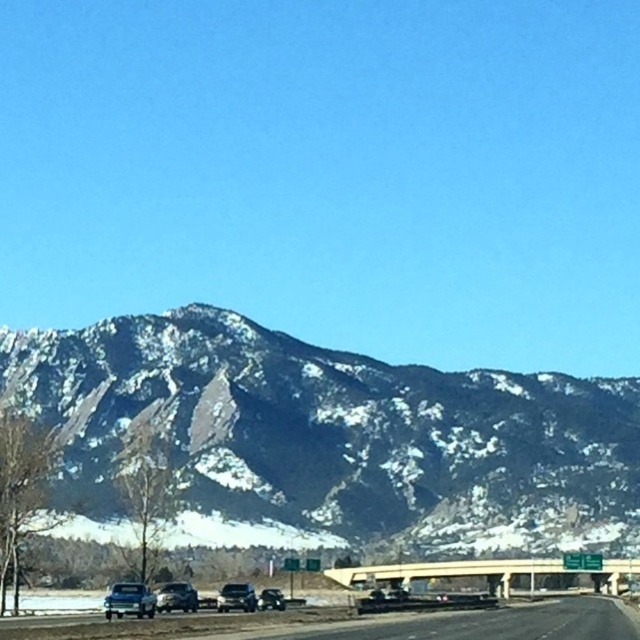
Question: Which object is positioned farthest from the shiny black suv at center?

Choices:
 (A) shiny black sedan at center
 (B) shiny silver sedan at center
 (C) shiny silver sedan at lower left

Answer: (C)

Question: Observing the image, what is the correct spatial positioning of snowy granite mountain range at upper center in reference to shiny black suv at center?

Choices:
 (A) left
 (B) right

Answer: (B)

Question: Which point is farther to the camera?

Choices:
 (A) (280, 605)
 (B) (225, 589)
 (C) (248, 410)
 (D) (195, 634)

Answer: (C)

Question: Is asphalt road at lower center bigger than concrete bridge at center?

Choices:
 (A) no
 (B) yes

Answer: (B)

Question: Does snowy granite mountain range at upper center appear on the left side of shiny black sedan at center?

Choices:
 (A) yes
 (B) no

Answer: (B)

Question: Which of the following is the farthest from the observer?

Choices:
 (A) (182, 589)
 (B) (368, 568)

Answer: (B)